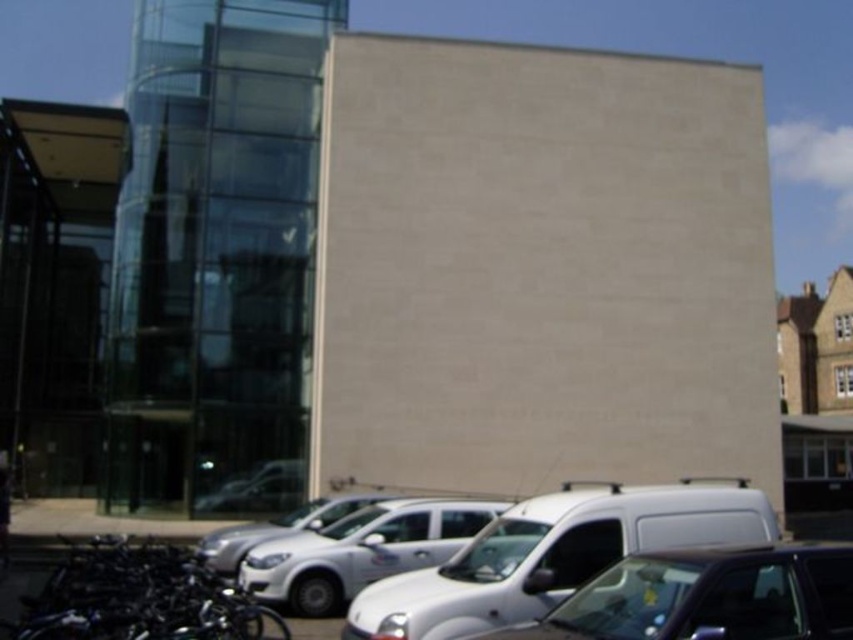
Does matte white van at lower center have a greater width compared to black matte bicycles at lower left?

Incorrect, matte white van at lower center's width does not surpass black matte bicycles at lower left's.

Can you confirm if matte white van at lower center is thinner than black matte bicycles at lower left?

Yes, matte white van at lower center is thinner than black matte bicycles at lower left.

Identify the location of matte white van at lower center. This screenshot has height=640, width=853. point(708,596).

Does point (814, 577) lie in front of point (308, 508)?

That is True.

Which is more to the right, matte white van at lower center or silver metallic car at center?

matte white van at lower center

What do you see at coordinates (708, 596) in the screenshot? I see `matte white van at lower center` at bounding box center [708, 596].

Locate an element on the screen. Image resolution: width=853 pixels, height=640 pixels. matte white van at lower center is located at coordinates (708, 596).

Is black matte bicycles at lower left positioned before silver metallic car at center?

Yes, it is.

Does black matte bicycles at lower left appear over silver metallic car at center?

Indeed, black matte bicycles at lower left is positioned over silver metallic car at center.

Between point (51, 609) and point (229, 561), which one is positioned behind?

Point (229, 561)

Where is `black matte bicycles at lower left`? black matte bicycles at lower left is located at coordinates (138, 596).